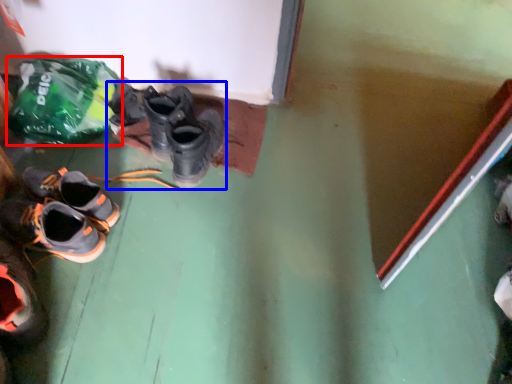
Question: Which point is closer to the camera, plastic bag (highlighted by a red box) or footwear (highlighted by a blue box)?

Choices:
 (A) plastic bag
 (B) footwear

Answer: (A)